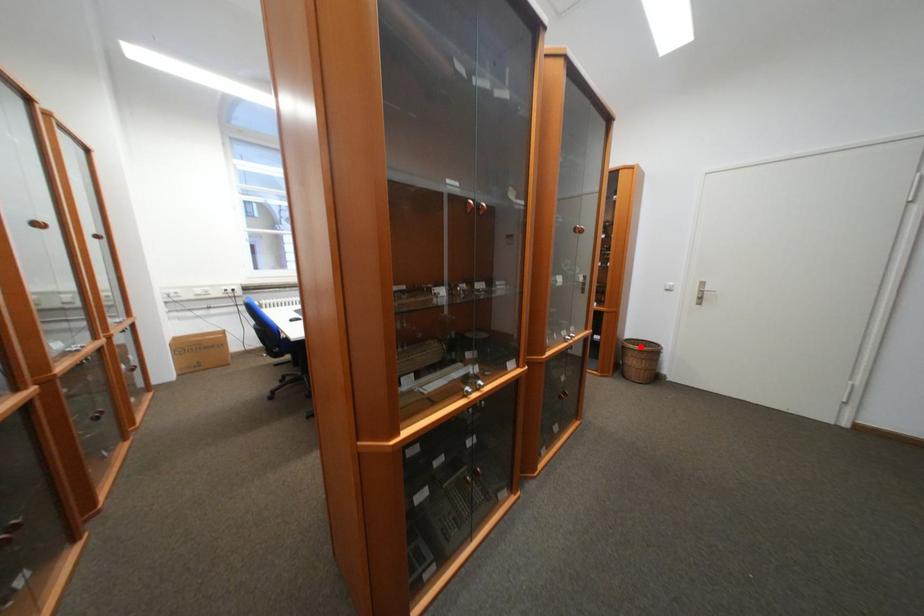
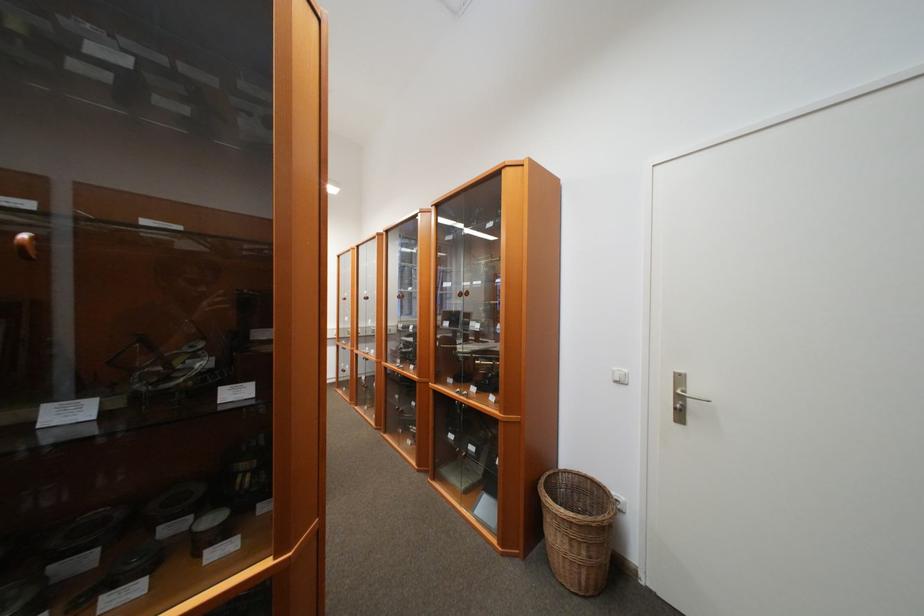
Locate, in the second image, the point that corresponds to the highlighted location in the first image.

(560, 501)